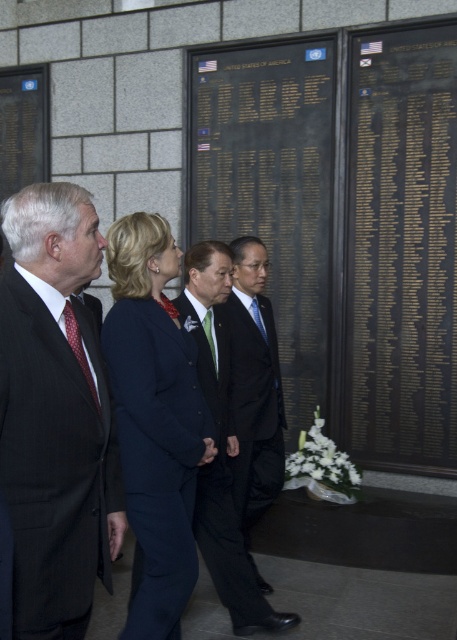
Where is the dark gray suit at left located in the image?

The dark gray suit at left is located at point (56,413).

You are attending a memorial event and notice two ties among the attendees. The polka dot silk tie at left and the blue silk tie at center. Which one is positioned more to the left?

The polka dot silk tie at left is positioned more to the left than the blue silk tie at center.